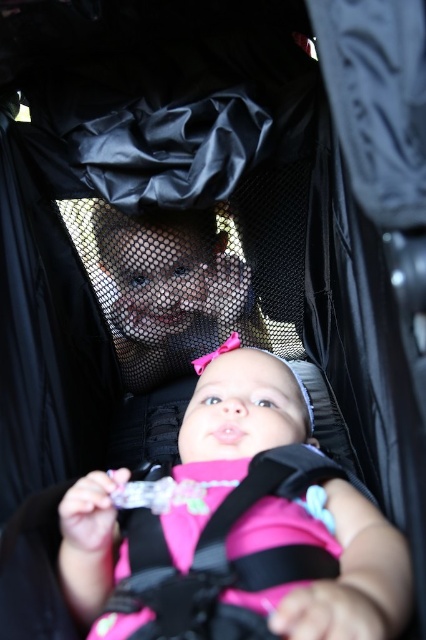
Question: Observing the image, what is the correct spatial positioning of pink fabric baby at center in reference to pink fabric strap at center?

Choices:
 (A) left
 (B) right

Answer: (B)

Question: Can you confirm if pink fabric baby at center is positioned to the right of pink fabric strap at center?

Choices:
 (A) yes
 (B) no

Answer: (A)

Question: Which of the following is the farthest from the observer?

Choices:
 (A) pink fabric strap at center
 (B) pink fabric baby at center

Answer: (A)

Question: Does pink fabric baby at center appear under pink fabric strap at center?

Choices:
 (A) yes
 (B) no

Answer: (B)